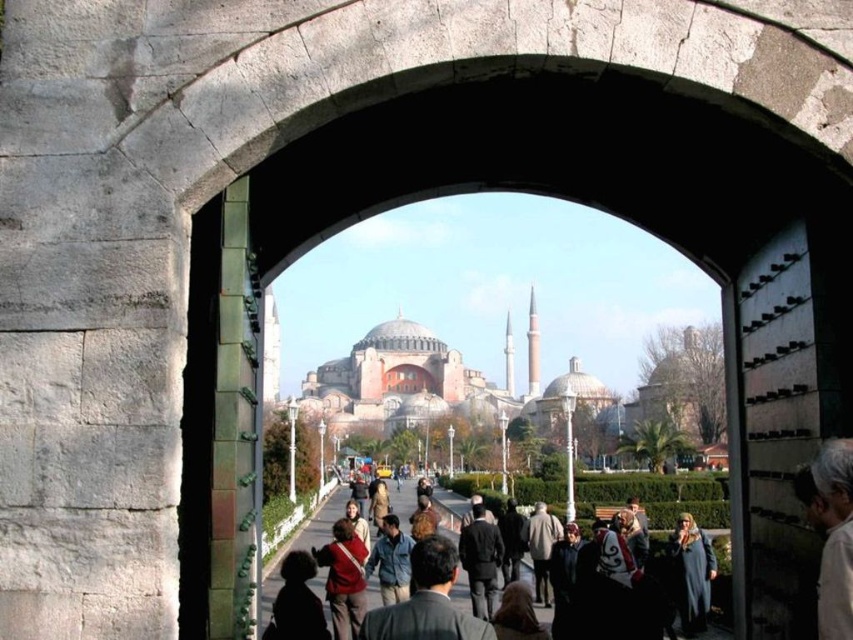
Is dark gray suit at center wider than matte red sweater at center?

Incorrect, dark gray suit at center's width does not surpass matte red sweater at center's.

Which is below, dark gray suit at center or matte red sweater at center?

Positioned lower is matte red sweater at center.

Where is `dark gray suit at center`? The image size is (853, 640). dark gray suit at center is located at coordinates (426, 600).

Between white fabric at right and matte red sweater at center, which one is positioned lower?

matte red sweater at center is below.

Where is `white fabric at right`? This screenshot has height=640, width=853. white fabric at right is located at coordinates (831, 532).

At what (x,y) coordinates should I click in order to perform the action: click on white fabric at right. Please return your answer as a coordinate pair (x, y). Looking at the image, I should click on (831, 532).

You are a GUI agent. You are given a task and a screenshot of the screen. Output one action in this format:
    pyautogui.click(x=<x>, y=<y>)
    Task: Click on the white fabric at right
    The image size is (853, 640).
    Given the screenshot: What is the action you would take?
    pyautogui.click(x=831, y=532)

Between point (838, 438) and point (282, 627), which one is positioned behind?

Point (282, 627)

At what (x,y) coordinates should I click in order to perform the action: click on white fabric at right. Please return your answer as a coordinate pair (x, y). The width and height of the screenshot is (853, 640). Looking at the image, I should click on point(831,532).

The width and height of the screenshot is (853, 640). Find the location of `white fabric at right`. white fabric at right is located at coordinates (831, 532).